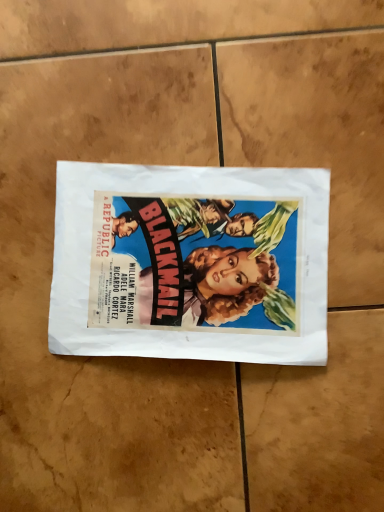
In order to face matte paper poster at center, should I rotate leftwards or rightwards?

Rotate your view left by about 0.864°.

This screenshot has width=384, height=512. Identify the location of matte paper poster at center. pos(190,263).

What do you see at coordinates (190, 263) in the screenshot?
I see `matte paper poster at center` at bounding box center [190, 263].

This screenshot has height=512, width=384. Find the location of `matte paper poster at center`. matte paper poster at center is located at coordinates (190, 263).